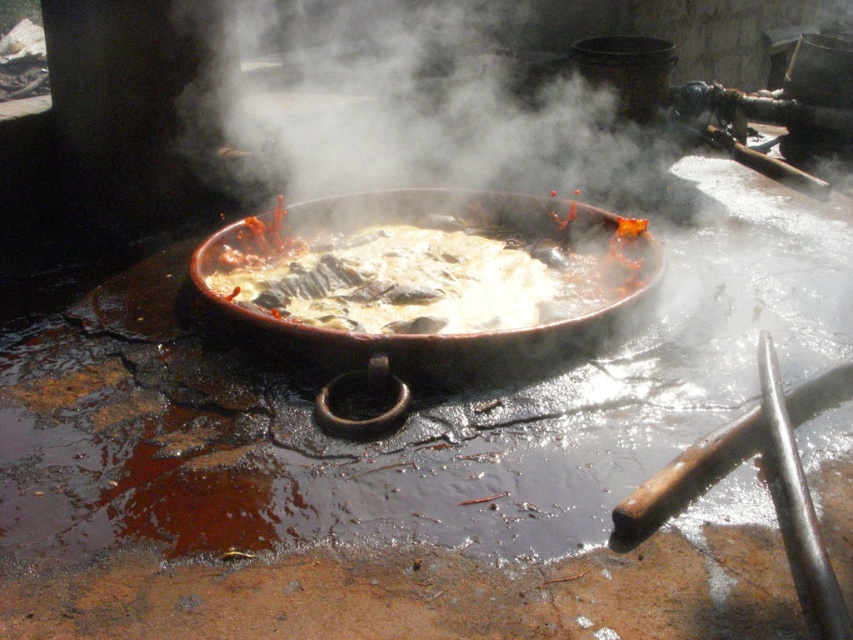
Is shiny black wok at center below white vapor at center?

Yes.

Where is `shiny black wok at center`? shiny black wok at center is located at coordinates (422, 289).

The image size is (853, 640). Describe the element at coordinates (422, 289) in the screenshot. I see `shiny black wok at center` at that location.

Where is `shiny black wok at center`? The height and width of the screenshot is (640, 853). shiny black wok at center is located at coordinates (422, 289).